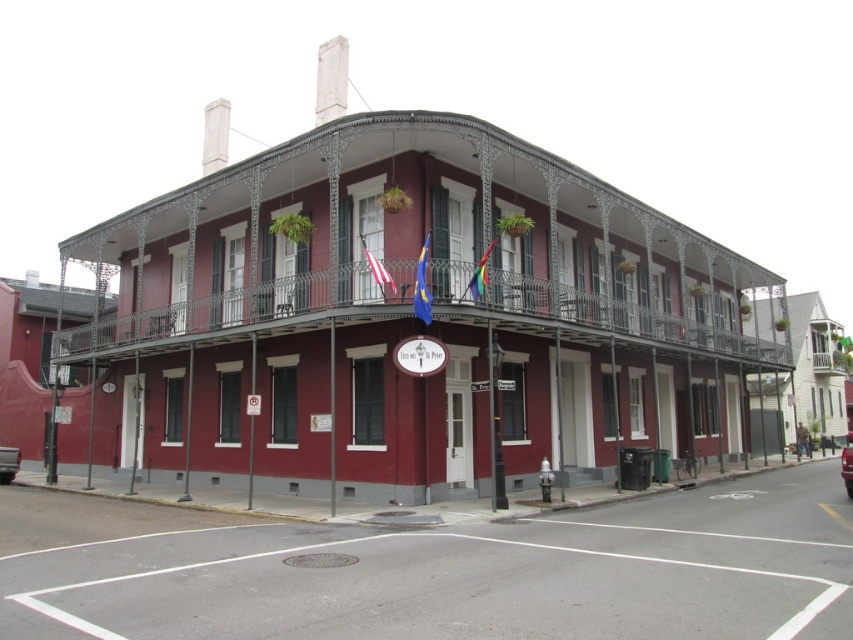
Is metallic wrought iron balcony at center above shiny red car at center?

Correct, metallic wrought iron balcony at center is located above shiny red car at center.

Describe the element at coordinates (413, 248) in the screenshot. This screenshot has width=853, height=640. I see `metallic wrought iron balcony at center` at that location.

Find the location of a particular element. The image size is (853, 640). metallic wrought iron balcony at center is located at coordinates (413, 248).

Is point (479, 294) more distant than point (1, 480)?

That is False.

Between rainbow fabric flag at upper center and metallic silver truck at lower left, which one appears on the left side from the viewer's perspective?

metallic silver truck at lower left is more to the left.

In order to click on rainbow fabric flag at upper center in this screenshot , I will do `click(480, 273)`.

At what (x,y) coordinates should I click in order to perform the action: click on rainbow fabric flag at upper center. Please return your answer as a coordinate pair (x, y). The width and height of the screenshot is (853, 640). Looking at the image, I should click on 480,273.

Which of these two, white wood sign at center or white fabric flag at center, stands shorter?

white wood sign at center

Who is more distant from viewer, (x=444, y=355) or (x=378, y=275)?

The point (x=444, y=355) is more distant.

Find the location of a particular element. This screenshot has height=640, width=853. white wood sign at center is located at coordinates (421, 355).